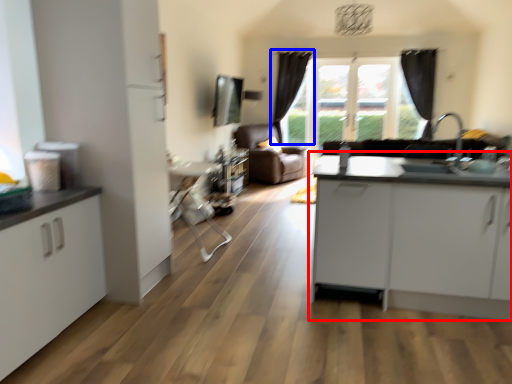
Question: Among these objects, which one is farthest to the camera, table (highlighted by a red box) or curtain (highlighted by a blue box)?

Choices:
 (A) table
 (B) curtain

Answer: (B)